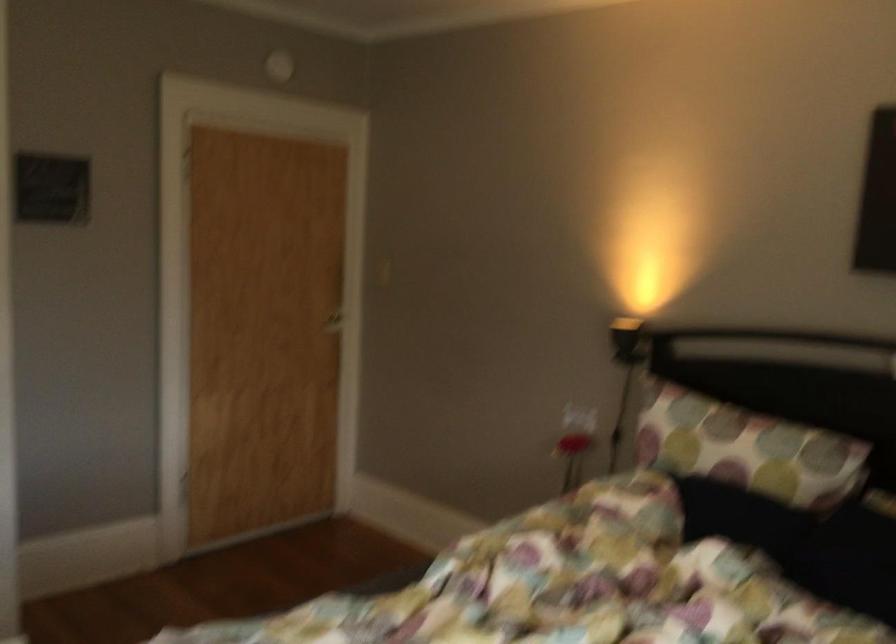
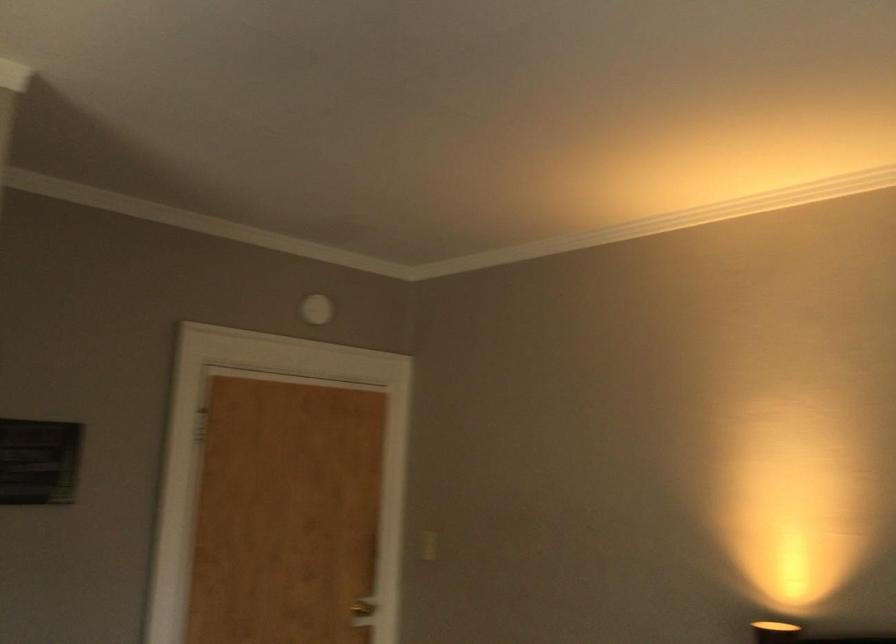
Question: In a continuous first-person perspective shot, in which direction is the camera moving?

Choices:
 (A) Left
 (B) Right
 (C) Forward
 (D) Backward

Answer: (C)